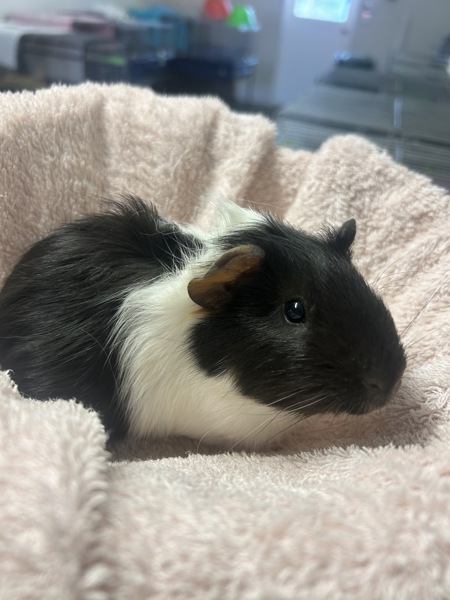
I want to click on window, so click(320, 12).